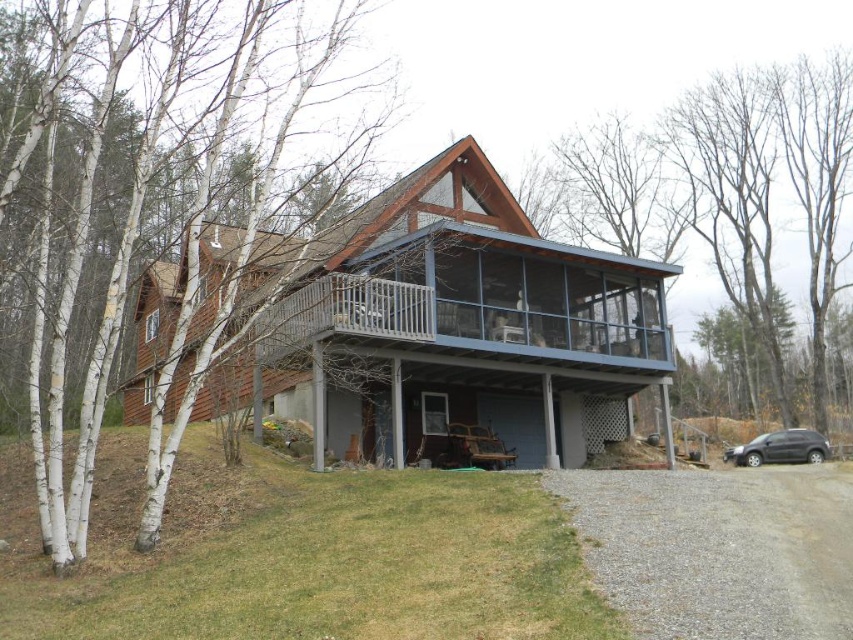
Between blue glass porch at upper center and satin black suv at lower right, which one appears on the right side from the viewer's perspective?

Positioned to the right is satin black suv at lower right.

From the picture: Can you confirm if blue glass porch at upper center is positioned to the left of satin black suv at lower right?

Correct, you'll find blue glass porch at upper center to the left of satin black suv at lower right.

Is point (329, 305) less distant than point (795, 428)?

Yes, point (329, 305) is closer to viewer.

At what (x,y) coordinates should I click in order to perform the action: click on blue glass porch at upper center. Please return your answer as a coordinate pair (x, y). The height and width of the screenshot is (640, 853). Looking at the image, I should click on (447, 324).

Is white bark tree at left behind blue glass porch at upper center?

No, white bark tree at left is closer to the viewer.

You are a GUI agent. You are given a task and a screenshot of the screen. Output one action in this format:
    pyautogui.click(x=<x>, y=<y>)
    Task: Click on the white bark tree at left
    The image size is (853, 640).
    Given the screenshot: What is the action you would take?
    pyautogui.click(x=200, y=218)

Is point (235, 200) less distant than point (329, 332)?

That is False.

Find the location of a particular element. white bark tree at left is located at coordinates (200, 218).

Can you confirm if white bark tree at left is thinner than gravel at lower right?

In fact, white bark tree at left might be wider than gravel at lower right.

Based on the photo, can you confirm if white bark tree at left is positioned to the left of gravel at lower right?

Yes, white bark tree at left is to the left of gravel at lower right.

This screenshot has height=640, width=853. I want to click on white bark tree at left, so click(200, 218).

Find the location of a particular element. white bark tree at left is located at coordinates (200, 218).